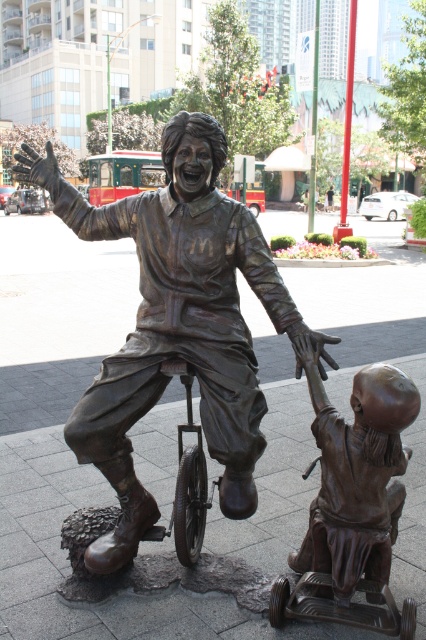
Question: Among these objects, which one is farthest from the camera?

Choices:
 (A) bronze baby at lower right
 (B) bronze statue at center

Answer: (B)

Question: Is bronze statue at center to the right of bronze baby at lower right from the viewer's perspective?

Choices:
 (A) no
 (B) yes

Answer: (A)

Question: Which of the following is the closest to the observer?

Choices:
 (A) (379, 525)
 (B) (138, 225)

Answer: (A)

Question: Is bronze statue at center smaller than bronze baby at lower right?

Choices:
 (A) yes
 (B) no

Answer: (B)

Question: Which object appears closest to the camera in this image?

Choices:
 (A) bronze statue at center
 (B) bronze baby at lower right

Answer: (B)

Question: Observing the image, what is the correct spatial positioning of bronze statue at center in reference to bronze baby at lower right?

Choices:
 (A) right
 (B) left

Answer: (B)